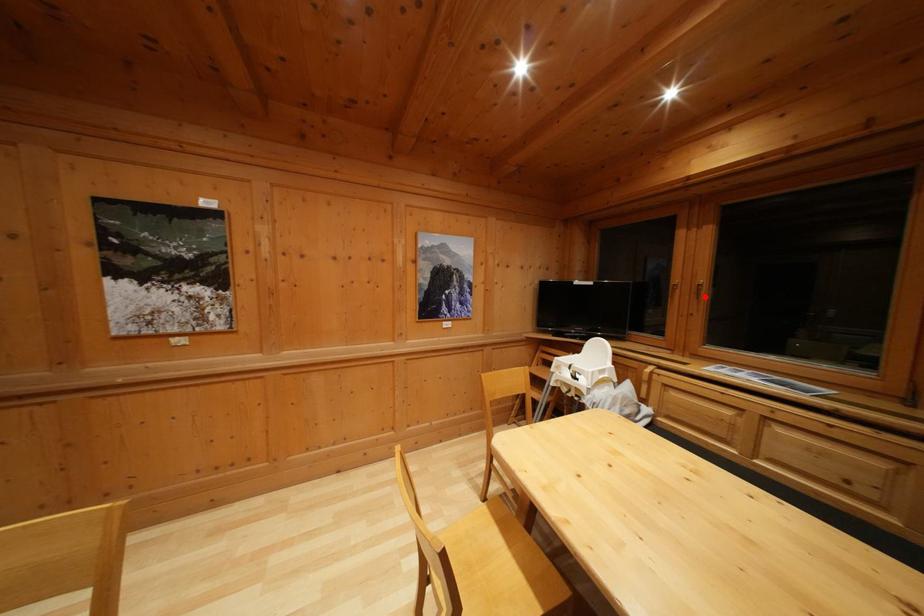
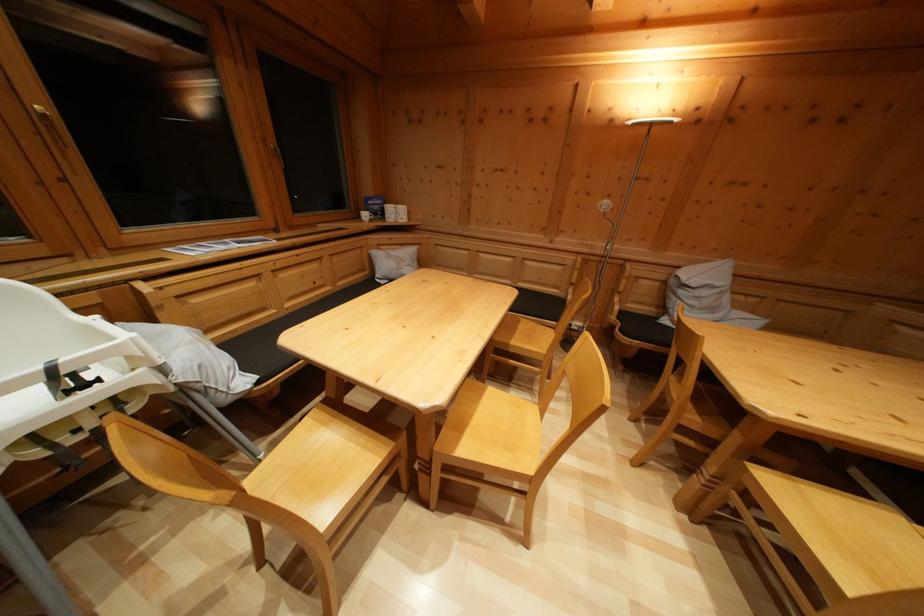
Find the pixel in the second image that matches the highlighted location in the first image.

(58, 135)